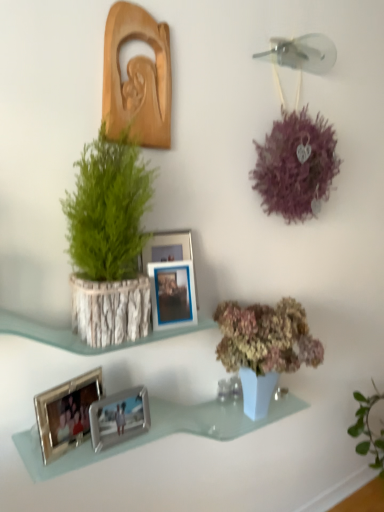
Question: Is metallic silver photo frame at center, which appears as the second picture frame when viewed from the top, oriented towards blue metallic picture frame at center, the third picture frame when ordered from bottom to top?

Choices:
 (A) no
 (B) yes

Answer: (B)

Question: Is metallic silver photo frame at center, which appears as the second picture frame when viewed from the top, touching blue metallic picture frame at center, which is the 3th picture frame in top-to-bottom order?

Choices:
 (A) yes
 (B) no

Answer: (A)

Question: Is blue metallic picture frame at center, which is the 3th picture frame in top-to-bottom order, at the back of metallic silver photo frame at center, which appears as the second picture frame when viewed from the top?

Choices:
 (A) yes
 (B) no

Answer: (A)

Question: Can you confirm if metallic silver photo frame at center, the fourth picture frame in the bottom-to-top sequence, is taller than blue metallic picture frame at center, which is the 3th picture frame in top-to-bottom order?

Choices:
 (A) yes
 (B) no

Answer: (A)

Question: Does metallic silver photo frame at center, the fourth picture frame in the bottom-to-top sequence, appear on the right side of blue metallic picture frame at center, which is the 3th picture frame in top-to-bottom order?

Choices:
 (A) no
 (B) yes

Answer: (A)

Question: From a real-world perspective, is metallic silver photo frame at center, which appears as the second picture frame when viewed from the top, over blue metallic picture frame at center, which is the 3th picture frame in top-to-bottom order?

Choices:
 (A) yes
 (B) no

Answer: (A)

Question: From a real-world perspective, is silver metallic photo frame at lower left, the second picture frame positioned from the bottom, positioned under wooden carving at upper left, the 5th picture frame in the bottom-to-top sequence, based on gravity?

Choices:
 (A) no
 (B) yes

Answer: (B)

Question: Is silver metallic photo frame at lower left, the second picture frame positioned from the bottom, facing away from wooden carving at upper left, positioned as the 1th picture frame in top-to-bottom order?

Choices:
 (A) yes
 (B) no

Answer: (B)

Question: From the image's perspective, is silver metallic photo frame at lower left, the second picture frame positioned from the bottom, on wooden carving at upper left, the 5th picture frame in the bottom-to-top sequence?

Choices:
 (A) no
 (B) yes

Answer: (A)

Question: Is silver metallic photo frame at lower left, which appears as the 4th picture frame when viewed from the top, to the right of wooden carving at upper left, positioned as the 1th picture frame in top-to-bottom order, from the viewer's perspective?

Choices:
 (A) yes
 (B) no

Answer: (B)

Question: Does silver metallic photo frame at lower left, the second picture frame positioned from the bottom, appear on the left side of wooden carving at upper left, the 5th picture frame in the bottom-to-top sequence?

Choices:
 (A) no
 (B) yes

Answer: (B)

Question: Can you confirm if silver metallic photo frame at lower left, the second picture frame positioned from the bottom, is shorter than wooden carving at upper left, the 5th picture frame in the bottom-to-top sequence?

Choices:
 (A) no
 (B) yes

Answer: (B)

Question: Is the depth of silver metallic photo frame at lower left, the second picture frame positioned from the bottom, greater than that of silver metallic photo frame at lower center, marked as the 1th picture frame in a bottom-to-top arrangement?

Choices:
 (A) yes
 (B) no

Answer: (B)